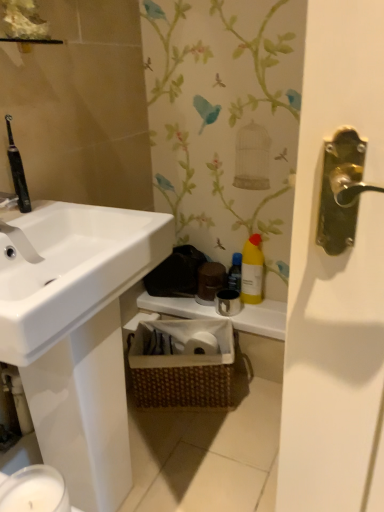
The width and height of the screenshot is (384, 512). In order to click on empty space that is ontop of white matte counter top at center (from a real-world perspective) in this screenshot , I will do (231, 301).